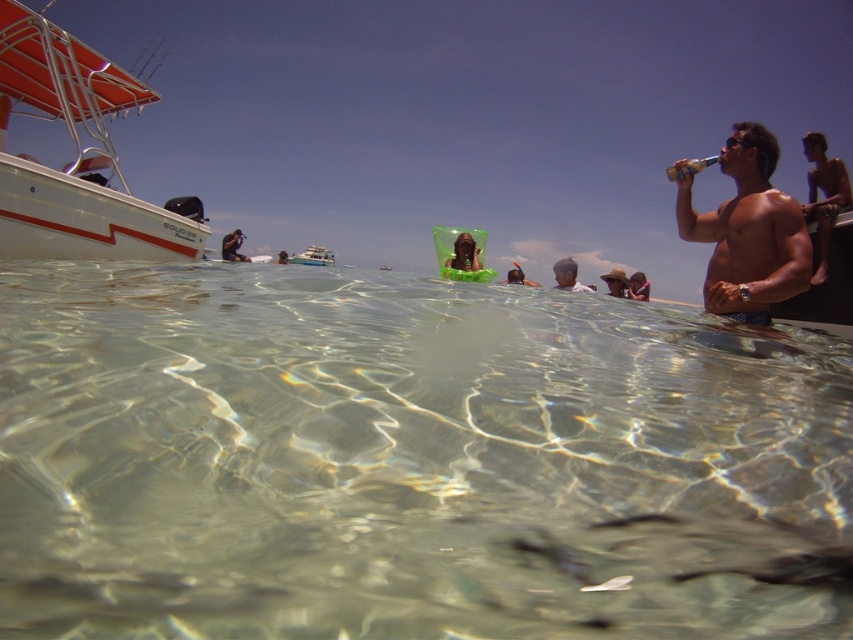
You are a photographer trying to capture the reflection of the shiny metallic torso at right and the shiny metallic tank top at upper right in the water. Which object will have a larger reflection in the water?

The shiny metallic torso at right is bigger than the shiny metallic tank top at upper right, so its reflection will also be larger.

Looking at this image, you are a photographer taking a picture of the beach scene. You notice the shiny metallic tank top at upper right and the translucent plastic bottle at upper right. Which object should you focus on if you want to capture the larger object in your shot?

The shiny metallic tank top at upper right is larger than the translucent plastic bottle at upper right, so you should focus on the shiny metallic tank top at upper right to capture the larger object.

You are a photographer positioned at the center of the beach scene. You want to take a photo of the smooth skin man at upper right. Which direction should you move to get him in the frame?

The smooth skin man at upper right is located at point (567, 275), so you should move to your left and slightly forward to center him in the frame.